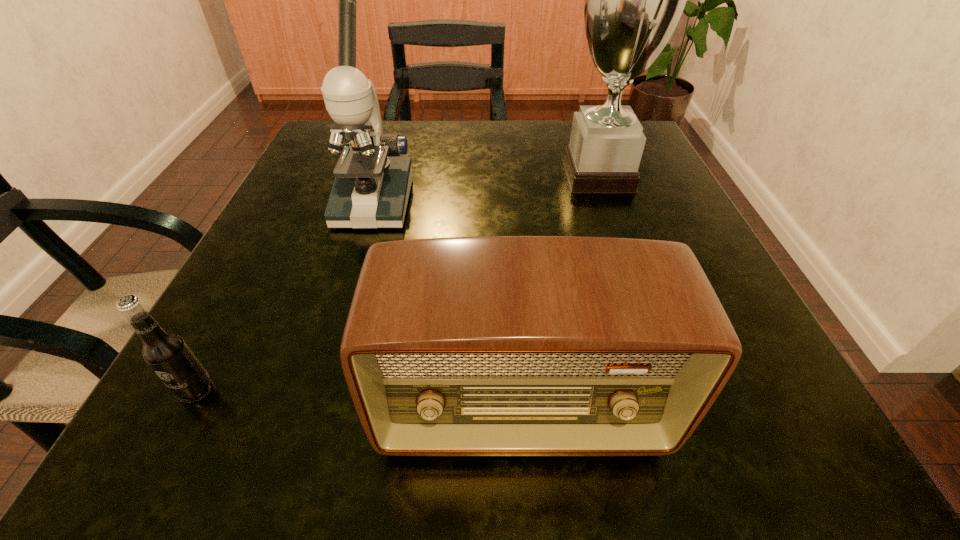
Identify the location of free region at the left edge of the desktop. This screenshot has width=960, height=540. (322, 328).

Find the location of `free location at the right edge`. free location at the right edge is located at coordinates (656, 183).

Locate an element on the screen. vacant area at the far right corner is located at coordinates (570, 127).

The image size is (960, 540). Identify the location of vacant space at the near right corner of the desktop. (x=732, y=441).

At what (x,y) coordinates should I click in order to perform the action: click on free area in between the tallest object and the third object from right to left. Please return your answer as a coordinate pair (x, y). Image resolution: width=960 pixels, height=540 pixels. Looking at the image, I should click on (486, 189).

At what (x,y) coordinates should I click in order to perform the action: click on vacant area that lies between the tallest object and the second object from left to right. Please return your answer as a coordinate pair (x, y). The height and width of the screenshot is (540, 960). Looking at the image, I should click on (486, 189).

You are a GUI agent. You are given a task and a screenshot of the screen. Output one action in this format:
    pyautogui.click(x=<x>, y=<y>)
    Task: Click on the unoccupied area between the root beer and the third shortest object
    The image size is (960, 540).
    Given the screenshot: What is the action you would take?
    click(x=284, y=296)

Identify which object is located as the nearest to the second object from left to right. Please provide its 2D coordinates. Your answer should be formatted as a tuple, i.e. [(x, y)], where the tuple contains the x and y coordinates of a point satisfying the conditions above.

[(493, 345)]

Locate which object ranks in proximity to the radio receiver. Please provide its 2D coordinates. Your answer should be formatted as a tuple, i.e. [(x, y)], where the tuple contains the x and y coordinates of a point satisfying the conditions above.

[(168, 355)]

At what (x,y) coordinates should I click in order to perform the action: click on free location that satisfies the following two spatial constraints: 1. at the front view of the tallest object; 2. on the front-facing side of the radio receiver. Please return your answer as a coordinate pair (x, y). The height and width of the screenshot is (540, 960). Looking at the image, I should click on (684, 412).